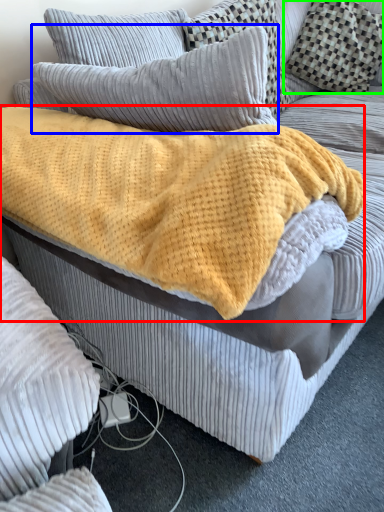
Question: Which object is positioned closest to blanket (highlighted by a red box)? Select from pillow (highlighted by a blue box) and pillow (highlighted by a green box).

Choices:
 (A) pillow
 (B) pillow

Answer: (A)